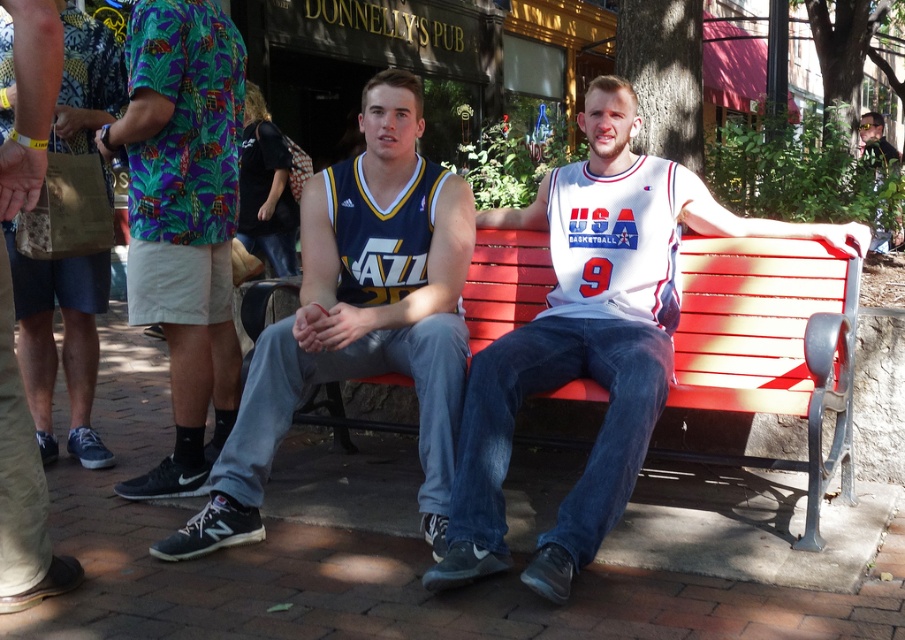
Which is more to the right, white jersey at center or blue jersey at center?

From the viewer's perspective, white jersey at center appears more on the right side.

Between point (478, 497) and point (355, 179), which one is positioned in front?

Point (478, 497) is in front.

Is point (848, 252) positioned behind point (348, 230)?

No, (848, 252) is closer to viewer.

The height and width of the screenshot is (640, 905). Identify the location of white jersey at center. (589, 339).

Is white jersey at center smaller than printed fabric shirt at left?

Incorrect, white jersey at center is not smaller in size than printed fabric shirt at left.

Which of these two, white jersey at center or printed fabric shirt at left, stands shorter?

Standing shorter between the two is white jersey at center.

Is point (512, 355) more distant than point (198, 45)?

No, (512, 355) is closer to viewer.

At what (x,y) coordinates should I click in order to perform the action: click on white jersey at center. Please return your answer as a coordinate pair (x, y). The width and height of the screenshot is (905, 640). Looking at the image, I should click on (589, 339).

Locate an element on the screen. Image resolution: width=905 pixels, height=640 pixels. printed fabric shirt at left is located at coordinates (183, 218).

Which is above, printed fabric shirt at left or khaki shorts at center?

printed fabric shirt at left

Who is more forward, (224, 300) or (45, 163)?

Positioned in front is point (45, 163).

At what (x,y) coordinates should I click in order to perform the action: click on printed fabric shirt at left. Please return your answer as a coordinate pair (x, y). This screenshot has height=640, width=905. Looking at the image, I should click on (183, 218).